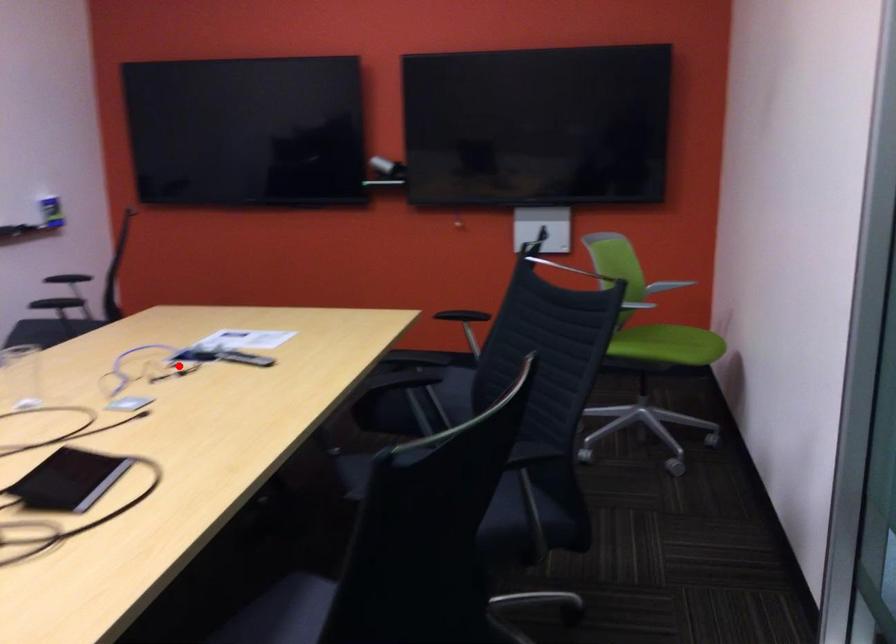
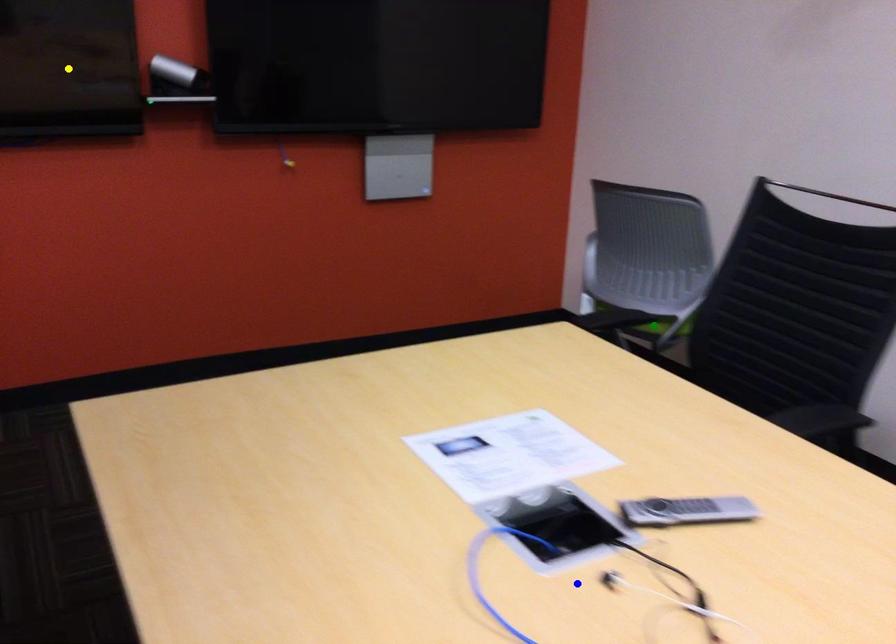
Question: I am providing you with two images of the same scene from different viewpoints. A red point is marked on the first image. You are given multiple points on the second image. Can you choose the point in image 2 that corresponds to the point in image 1?

Choices:
 (A) green point
 (B) blue point
 (C) yellow point

Answer: (B)